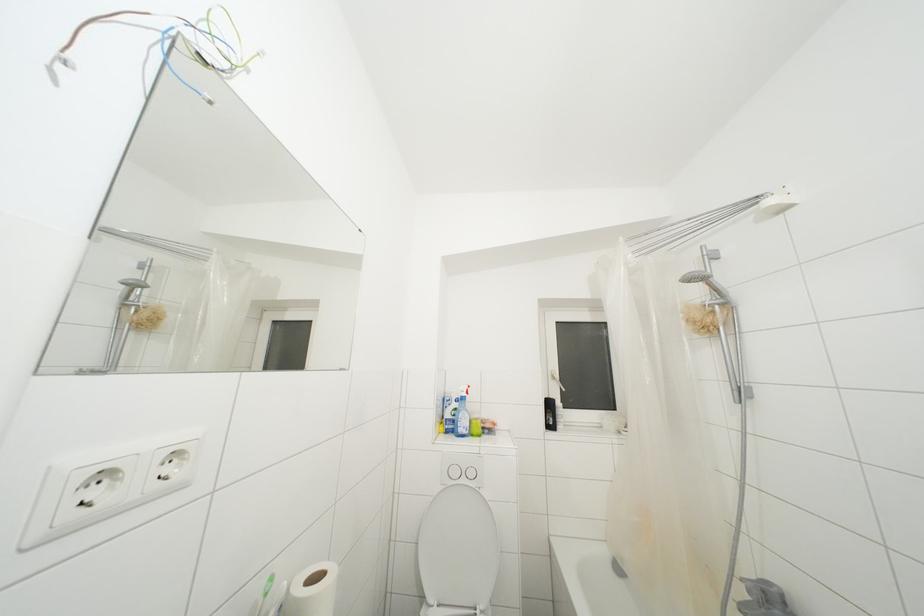
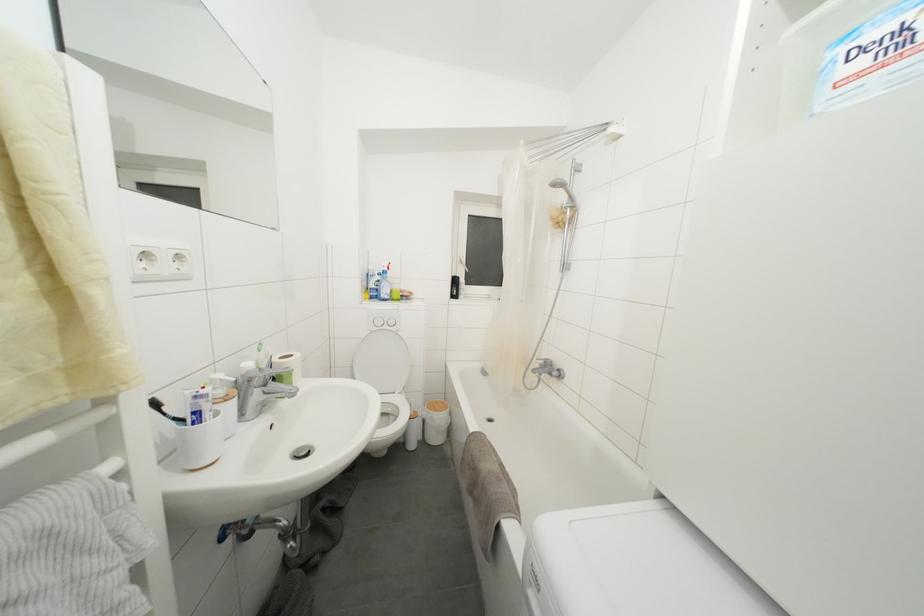
Find the pixel in the second image that matches (455,432) in the first image.

(379, 300)